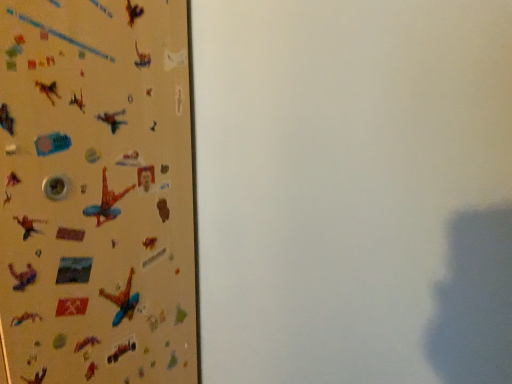
Describe the element at coordinates (96, 193) in the screenshot. I see `wooden picture frame at left` at that location.

The width and height of the screenshot is (512, 384). Identify the location of wooden picture frame at left. (96, 193).

Find the location of a particular element. wooden picture frame at left is located at coordinates (96, 193).